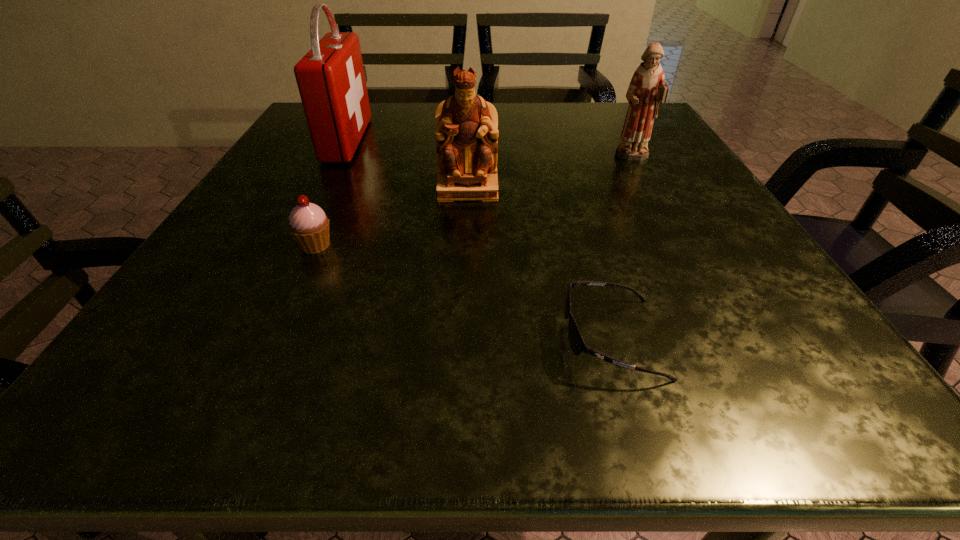
Find the location of a particular element. The height and width of the screenshot is (540, 960). vacant point located between the right figurine and the fourth farthest object is located at coordinates (474, 202).

You are a GUI agent. You are given a task and a screenshot of the screen. Output one action in this format:
    pyautogui.click(x=<x>, y=<y>)
    Task: Click on the vacant area that lies between the cupcake and the tallest object
    
    Given the screenshot: What is the action you would take?
    pyautogui.click(x=331, y=193)

This screenshot has width=960, height=540. Find the location of `vacant area that lies between the fourth farthest object and the farther figurine`. vacant area that lies between the fourth farthest object and the farther figurine is located at coordinates (474, 202).

Identify the location of free area in between the cupcake and the tallest object. (331, 193).

In order to click on blank region between the cupcake and the right figurine in this screenshot , I will do `click(474, 202)`.

I want to click on free spot between the cupcake and the sunglasses, so click(464, 292).

This screenshot has height=540, width=960. I want to click on vacant area between the nearer figurine and the first-aid kit, so click(407, 164).

Image resolution: width=960 pixels, height=540 pixels. What are the coordinates of `vacant region between the first-aid kit and the nearer figurine` in the screenshot? It's located at (407, 164).

Choose which object is the fourth nearest neighbor to the second nearest object. Please provide its 2D coordinates. Your answer should be formatted as a tuple, i.e. [(x, y)], where the tuple contains the x and y coordinates of a point satisfying the conditions above.

[(647, 89)]

Where is `object that is the third closest to the third object from right to left`? This screenshot has height=540, width=960. object that is the third closest to the third object from right to left is located at coordinates (647, 89).